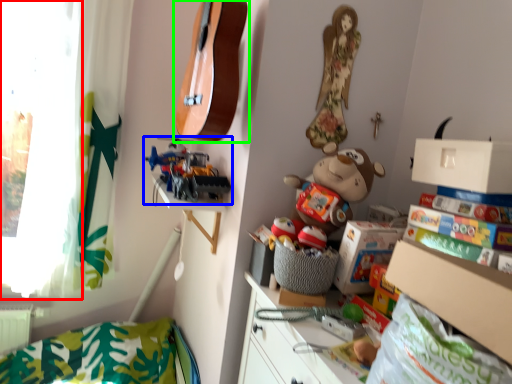
Question: Which is farther away from window screen (highlighted by a red box)? toy (highlighted by a blue box) or guitar (highlighted by a green box)?

Choices:
 (A) toy
 (B) guitar

Answer: (B)